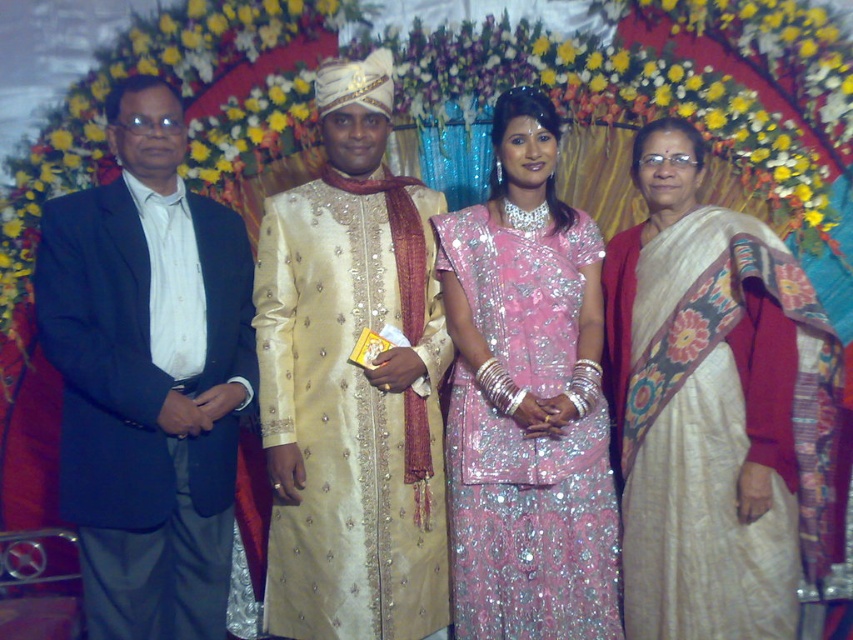
Can you confirm if dark blue suit at left is taller than pink sequined saree at center?

Correct, dark blue suit at left is much taller as pink sequined saree at center.

Does point (213, 292) lie behind point (496, 522)?

That is False.

This screenshot has height=640, width=853. I want to click on dark blue suit at left, so 148,376.

Between point (183, 477) and point (270, 388), which one is positioned behind?

Point (270, 388)

This screenshot has width=853, height=640. In order to click on dark blue suit at left in this screenshot , I will do `click(148, 376)`.

Can you confirm if white silk saree at right is thinner than dark blue suit at left?

No, white silk saree at right is not thinner than dark blue suit at left.

Can you confirm if white silk saree at right is positioned to the right of dark blue suit at left?

Yes, white silk saree at right is to the right of dark blue suit at left.

Between point (724, 528) and point (207, 372), which one is positioned in front?

Positioned in front is point (724, 528).

In order to click on white silk saree at right in this screenshot , I will do `click(711, 406)`.